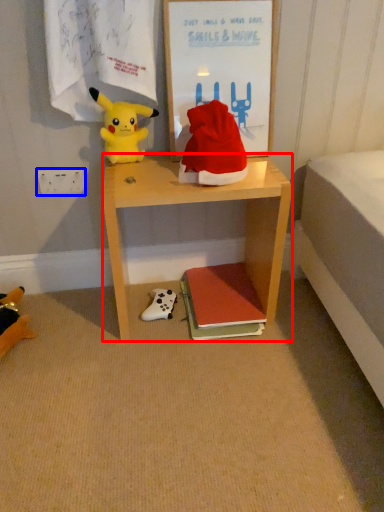
Question: Which object is further to the camera taking this photo, desk (highlighted by a red box) or power outlet (highlighted by a blue box)?

Choices:
 (A) desk
 (B) power outlet

Answer: (B)